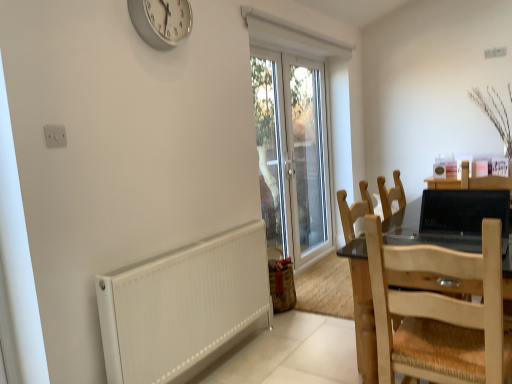
This screenshot has width=512, height=384. What do you see at coordinates (360, 286) in the screenshot?
I see `light brown wooden chair at right, which is counted as the 2th chair, starting from the front` at bounding box center [360, 286].

Image resolution: width=512 pixels, height=384 pixels. I want to click on natural wood chair at right, arranged as the second chair when viewed from the back, so click(440, 313).

In order to face black glossy laptop at right, should I rotate leftwards or rightwards?

A 25.447 degree turn to the right will do.

Measure the distance between transparent glass door at center and camera.

They are 2.76 meters apart.

You are a GUI agent. You are given a task and a screenshot of the screen. Output one action in this format:
    pyautogui.click(x=<x>, y=<y>)
    Task: Click on the light brown wooden chair at right, which is counted as the 2th chair, starting from the front
    Image resolution: width=512 pixels, height=384 pixels.
    Given the screenshot: What is the action you would take?
    pyautogui.click(x=360, y=286)

Does point (454, 197) lie in front of point (458, 349)?

No, (454, 197) is further to viewer.

From the image's perspective, which one is positioned lower, black glossy laptop at right or natural wood chair at right, which is counted as the 1th chair, starting from the front?

natural wood chair at right, which is counted as the 1th chair, starting from the front, appears lower in the image.

Is black glossy laptop at right outside of natural wood chair at right, which is counted as the 1th chair, starting from the front?

Absolutely, black glossy laptop at right is external to natural wood chair at right, which is counted as the 1th chair, starting from the front.

Considering the relative positions of black glossy laptop at right and natural wood chair at right, arranged as the second chair when viewed from the back, in the image provided, is black glossy laptop at right to the left of natural wood chair at right, arranged as the second chair when viewed from the back, from the viewer's perspective?

In fact, black glossy laptop at right is to the right of natural wood chair at right, arranged as the second chair when viewed from the back.

Where is `screen door lying behind the black glossy laptop at right`? The width and height of the screenshot is (512, 384). screen door lying behind the black glossy laptop at right is located at coordinates (307, 157).

Does black glossy laptop at right have a larger size compared to transparent glass door at center?

No, black glossy laptop at right is not bigger than transparent glass door at center.

From the image's perspective, is black glossy laptop at right on transparent glass door at center?

No, from the image's perspective, black glossy laptop at right is not on top of transparent glass door at center.

Is light brown wooden chair at right, which is counted as the first chair, starting from the back, beside white textured radiator at lower left?

No, light brown wooden chair at right, which is counted as the first chair, starting from the back, is not making contact with white textured radiator at lower left.

Does light brown wooden chair at right, which is counted as the 2th chair, starting from the front, lie behind white textured radiator at lower left?

Yes, light brown wooden chair at right, which is counted as the 2th chair, starting from the front, is further from the viewer.

Is point (356, 265) positioned behind point (136, 301)?

Yes, point (356, 265) is farther from viewer.

From the white textured radiator at lower left, count 2nd chair to the right and point to it. Please provide its 2D coordinates.

[(360, 286)]

Is point (306, 84) less distant than point (366, 191)?

No, (306, 84) is behind (366, 191).

In the image, is transparent glass door at center positioned in front of or behind light brown wooden chair at right, which is counted as the 2th chair, starting from the front?

transparent glass door at center is behind light brown wooden chair at right, which is counted as the 2th chair, starting from the front.

From the image's perspective, relative to light brown wooden chair at right, which is counted as the 2th chair, starting from the front, is transparent glass door at center above or below?

Based on their image positions, transparent glass door at center is located above light brown wooden chair at right, which is counted as the 2th chair, starting from the front.

From a real-world perspective, between transparent glass door at center and light brown wooden chair at right, which is counted as the first chair, starting from the back, who is vertically higher?

transparent glass door at center, from a real-world perspective.

Which of these two, natural wood chair at right, which is counted as the 1th chair, starting from the front, or transparent glass door at center, is bigger?

transparent glass door at center.

From the picture: Considering the sizes of objects natural wood chair at right, which is counted as the 1th chair, starting from the front, and transparent glass door at center in the image provided, who is wider, natural wood chair at right, which is counted as the 1th chair, starting from the front, or transparent glass door at center?

With larger width is natural wood chair at right, which is counted as the 1th chair, starting from the front.

Does natural wood chair at right, which is counted as the 1th chair, starting from the front, come behind transparent glass door at center?

No.

In terms of height, does natural wood chair at right, which is counted as the 1th chair, starting from the front, look taller or shorter compared to transparent glass door at center?

In the image, natural wood chair at right, which is counted as the 1th chair, starting from the front, appears to be shorter than transparent glass door at center.

From the image's perspective, which is above, white textured radiator at lower left or natural wood chair at right, arranged as the second chair when viewed from the back?

natural wood chair at right, arranged as the second chair when viewed from the back, appears higher in the image.

Is white textured radiator at lower left oriented away from natural wood chair at right, arranged as the second chair when viewed from the back?

No, white textured radiator at lower left is not facing the opposite direction of natural wood chair at right, arranged as the second chair when viewed from the back.

From the picture: Between white textured radiator at lower left and natural wood chair at right, arranged as the second chair when viewed from the back, which one has more height?

natural wood chair at right, arranged as the second chair when viewed from the back, is taller.

Is point (203, 337) less distant than point (457, 277)?

No, it is not.

Based on the photo, between white textured radiator at lower left and transparent glass door at center, which one appears on the right side from the viewer's perspective?

From the viewer's perspective, transparent glass door at center appears more on the right side.

Is white textured radiator at lower left placed right next to transparent glass door at center?

No, white textured radiator at lower left is not beside transparent glass door at center.

From a real-world perspective, is white textured radiator at lower left physically below transparent glass door at center?

Yes, from a real-world perspective, white textured radiator at lower left is under transparent glass door at center.

The height and width of the screenshot is (384, 512). I want to click on radiator that appears on the left of transparent glass door at center, so click(x=182, y=305).

Locate an element on the screen. laptop above the natural wood chair at right, which is counted as the 1th chair, starting from the front (from a real-world perspective) is located at coordinates (463, 212).

You are a GUI agent. You are given a task and a screenshot of the screen. Output one action in this format:
    pyautogui.click(x=<x>, y=<y>)
    Task: Click on the laptop that appears below the transparent glass door at center (from a real-world perspective)
    
    Given the screenshot: What is the action you would take?
    pyautogui.click(x=463, y=212)

Looking at the image, which one is located closer to silver metallic clock at upper center, black glossy laptop at right or white textured radiator at lower left?

white textured radiator at lower left.

Estimate the real-world distances between objects in this image. Which object is further from natural wood chair at right, arranged as the second chair when viewed from the back, white textured radiator at lower left or silver metallic clock at upper center?

Among the two, silver metallic clock at upper center is located further to natural wood chair at right, arranged as the second chair when viewed from the back.

Consider the image. Based on their spatial positions, is transparent glass door at center or silver metallic clock at upper center further from natural wood chair at right, which is counted as the 1th chair, starting from the front?

transparent glass door at center is positioned further to the anchor natural wood chair at right, which is counted as the 1th chair, starting from the front.

Based on their spatial positions, is natural wood chair at right, arranged as the second chair when viewed from the back, or light brown wooden chair at right, which is counted as the first chair, starting from the back, further from transparent glass door at center?

Among the two, natural wood chair at right, arranged as the second chair when viewed from the back, is located further to transparent glass door at center.

Estimate the real-world distances between objects in this image. Which object is closer to natural wood chair at right, which is counted as the 1th chair, starting from the front, light brown wooden chair at right, which is counted as the first chair, starting from the back, or transparent glass door at center?

Result: light brown wooden chair at right, which is counted as the first chair, starting from the back, lies closer to natural wood chair at right, which is counted as the 1th chair, starting from the front, than the other object.

Which object lies further to the anchor point silver metallic clock at upper center, transparent glass door at center or black glossy laptop at right?

The object further to silver metallic clock at upper center is transparent glass door at center.

From the image, which object appears to be farther from black glossy laptop at right, transparent glass door at center or light brown wooden chair at right, which is counted as the first chair, starting from the back?

transparent glass door at center.

Based on their spatial positions, is light brown wooden chair at right, which is counted as the 2th chair, starting from the front, or transparent glass door at center closer to transparent glass door at center?

The object closer to transparent glass door at center is transparent glass door at center.

Locate an element on the screen. window between white textured radiator at lower left and transparent glass door at center from front to back is located at coordinates (296, 133).

Image resolution: width=512 pixels, height=384 pixels. I want to click on radiator between black glossy laptop at right and transparent glass door at center along the z-axis, so click(x=182, y=305).

You are a GUI agent. You are given a task and a screenshot of the screen. Output one action in this format:
    pyautogui.click(x=<x>, y=<y>)
    Task: Click on the chair located between natural wood chair at right, arranged as the second chair when viewed from the back, and transparent glass door at center in the depth direction
    
    Given the screenshot: What is the action you would take?
    pyautogui.click(x=360, y=286)

I want to click on window positioned between black glossy laptop at right and transparent glass door at center from near to far, so click(x=296, y=133).